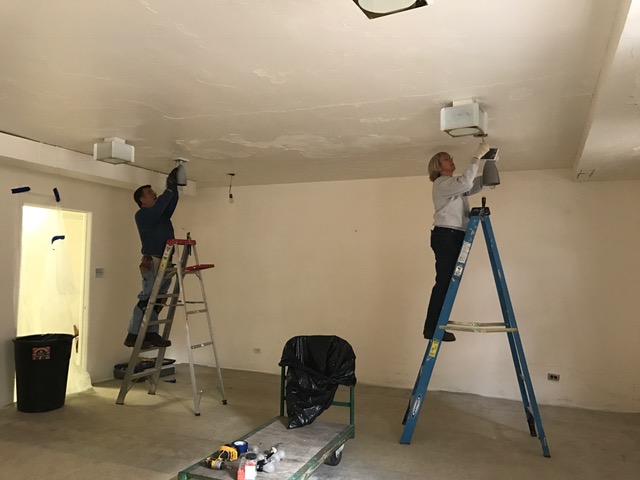
This screenshot has width=640, height=480. Identify the location of lightbulbs. (267, 467), (275, 457), (281, 454), (253, 450).